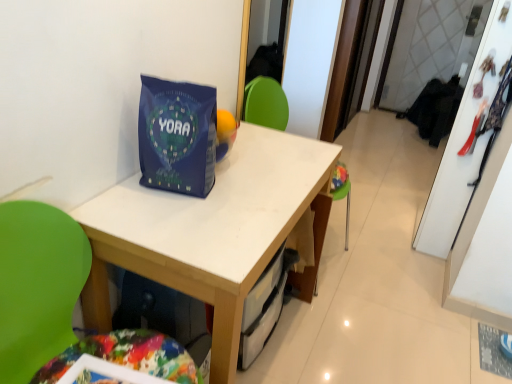
Question: Looking at the image, does white matte table at center seem bigger or smaller compared to blue matte gift bag at center?

Choices:
 (A) small
 (B) big

Answer: (B)

Question: Is white matte table at center wider or thinner than blue matte gift bag at center?

Choices:
 (A) thin
 (B) wide

Answer: (B)

Question: Considering the real-world distances, which object is closest to the green plastic chair at center?

Choices:
 (A) blue matte gift bag at center
 (B) white matte table at center

Answer: (B)

Question: Which object is the farthest from the green plastic chair at center?

Choices:
 (A) blue matte gift bag at center
 (B) white matte table at center

Answer: (A)